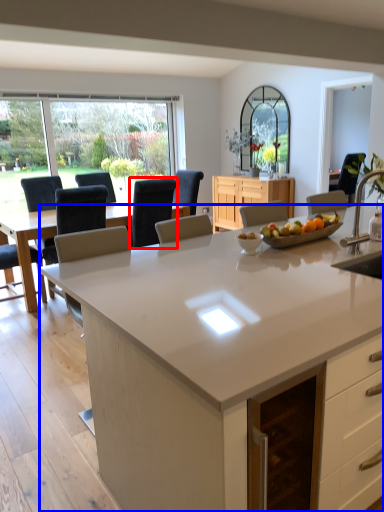
Question: Among these objects, which one is nearest to the camera, chair (highlighted by a red box) or countertop (highlighted by a blue box)?

Choices:
 (A) chair
 (B) countertop

Answer: (B)